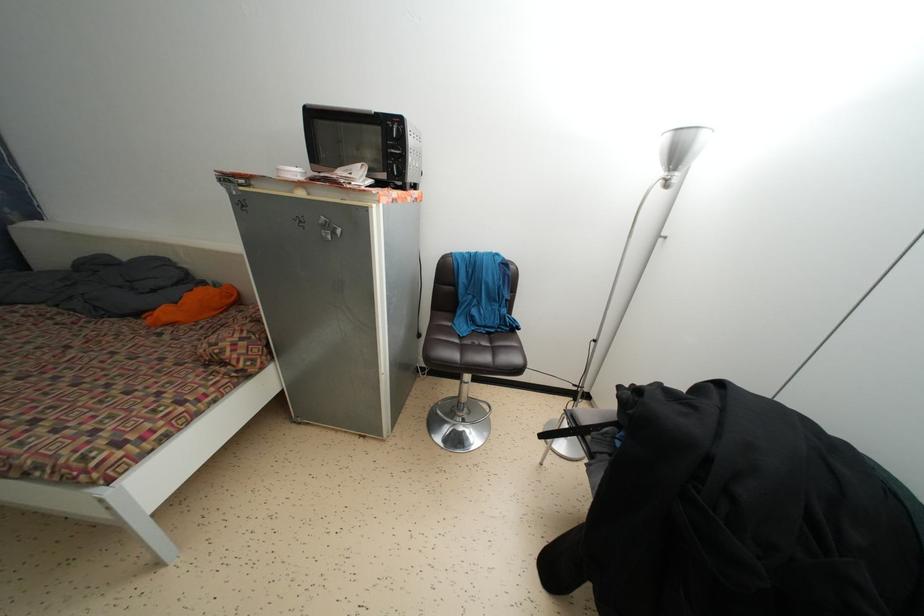
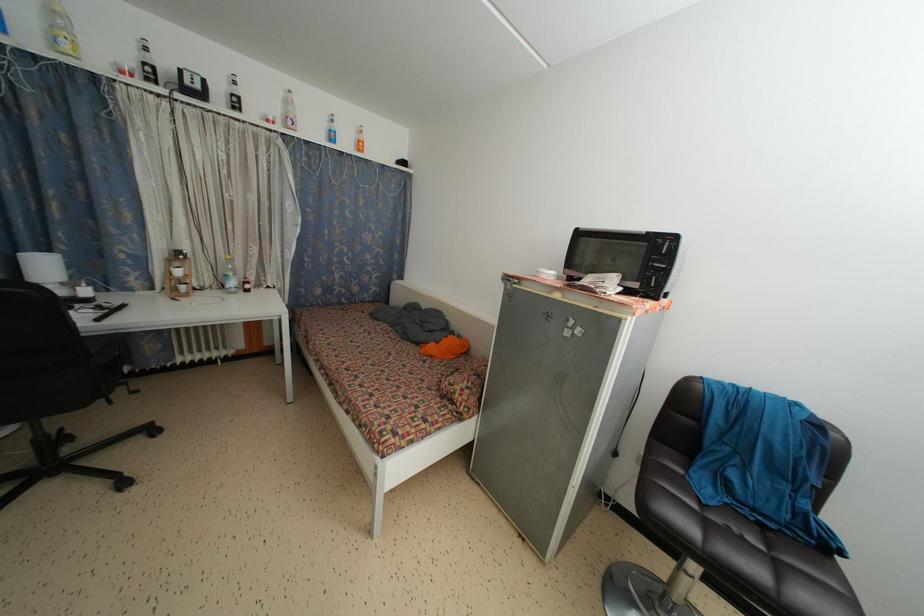
Locate, in the second image, the point that corresponds to point 71,354 in the first image.

(394, 360)